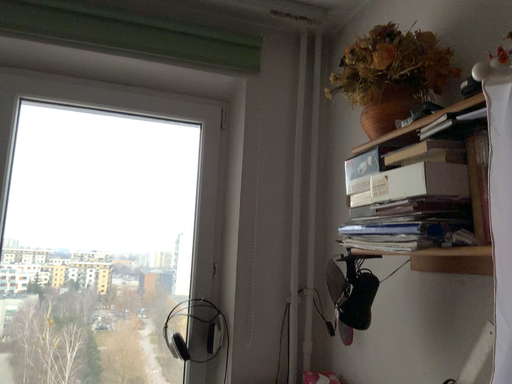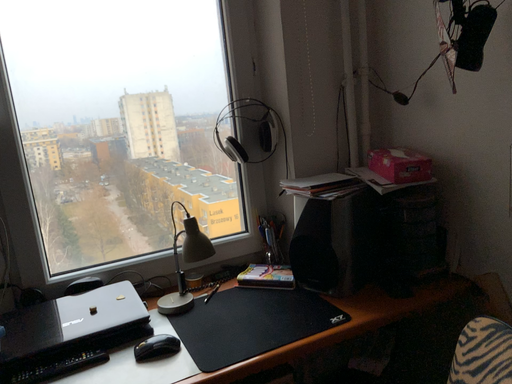
Question: Which way did the camera rotate in the video?

Choices:
 (A) rotated left
 (B) rotated right

Answer: (B)